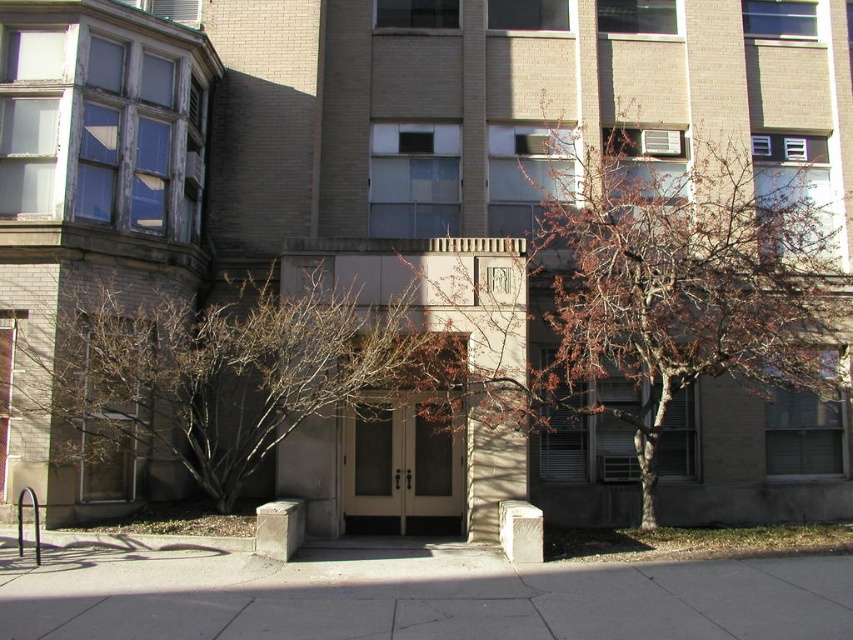
Question: Can you confirm if brown textured tree at center is positioned to the left of gray concrete sidewalk at center?

Choices:
 (A) no
 (B) yes

Answer: (A)

Question: Does brown textured tree at center come behind bare branches at center?

Choices:
 (A) no
 (B) yes

Answer: (B)

Question: Can you confirm if brown textured tree at center is smaller than bare branches at center?

Choices:
 (A) no
 (B) yes

Answer: (B)

Question: Which object is farther from the camera taking this photo?

Choices:
 (A) bare branches at center
 (B) brown textured tree at center
 (C) gray concrete sidewalk at center

Answer: (B)

Question: Based on their relative distances, which object is farther from the brown textured tree at center?

Choices:
 (A) gray concrete sidewalk at center
 (B) bare branches at center

Answer: (A)

Question: Which object appears closest to the camera in this image?

Choices:
 (A) gray concrete sidewalk at center
 (B) bare branches at center

Answer: (A)